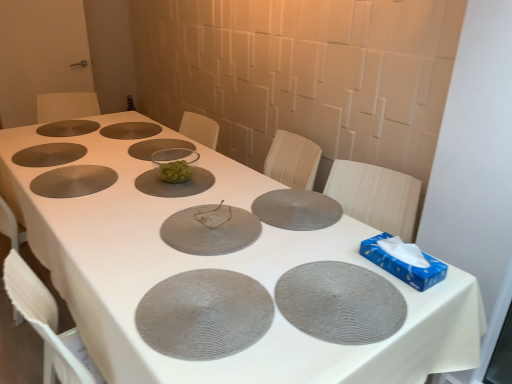
Identify the location of unoccupied space behind matte gray plate at upper left, which is the 7th glass plate in front-to-back order. (58, 130).